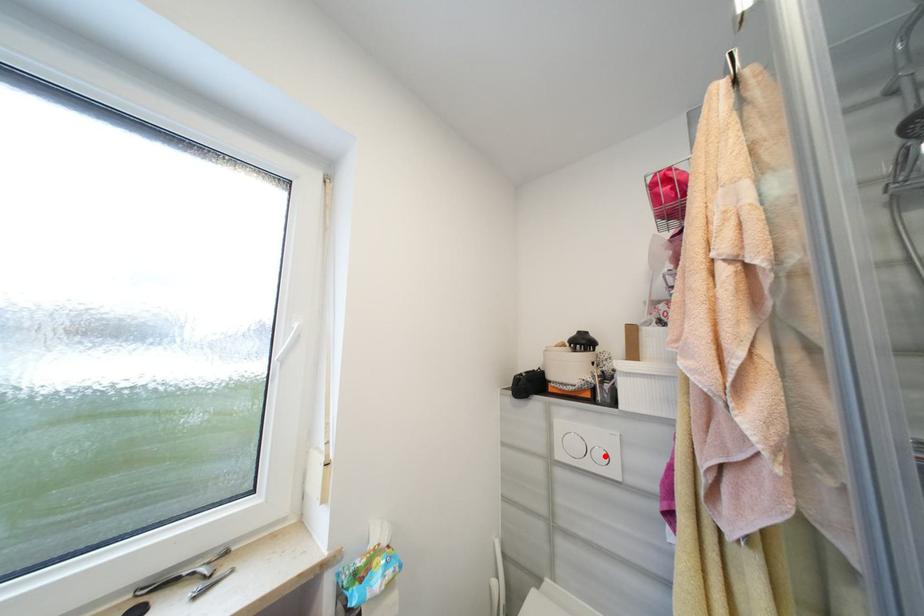
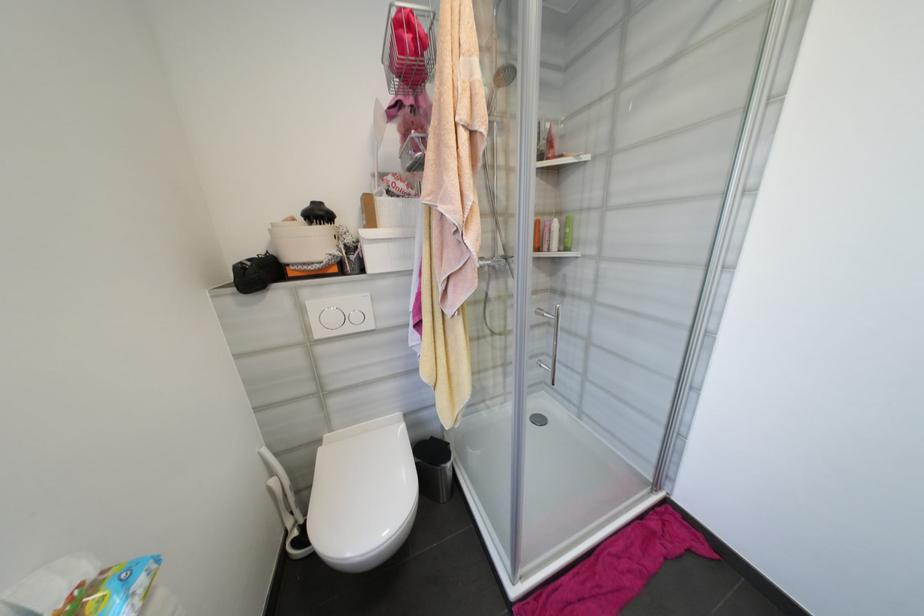
Question: I am providing you with two images of the same scene from different viewpoints. Image1 has a red point marked. In image2, the corresponding 3D location appears at what relative position? Reply with the corresponding letter.

Choices:
 (A) Closer
 (B) Farther

Answer: (A)